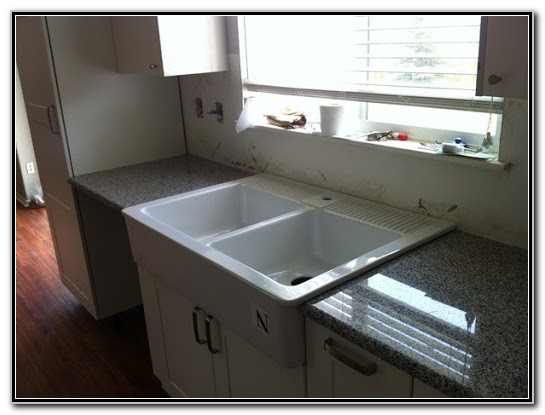
Where is `white blinds`? The width and height of the screenshot is (545, 415). white blinds is located at coordinates (393, 95).